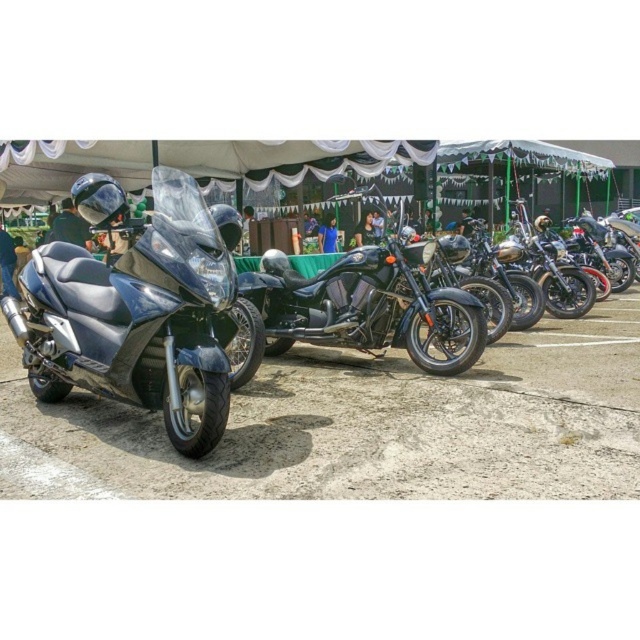
Question: Does matte black scooter at left appear on the left side of glossy black motorcycle at center?

Choices:
 (A) no
 (B) yes

Answer: (B)

Question: Does matte black scooter at left appear on the right side of shiny chrome motorcycle at center?

Choices:
 (A) yes
 (B) no

Answer: (B)

Question: Which of the following is the farthest from the observer?

Choices:
 (A) glossy black motorcycle at center
 (B) matte black scooter at left
 (C) shiny chrome motorcycle at center

Answer: (C)

Question: Estimate the real-world distances between objects in this image. Which object is farther from the shiny chrome motorcycle at center?

Choices:
 (A) glossy black motorcycle at center
 (B) matte black scooter at left

Answer: (B)

Question: Which of these objects is positioned farthest from the matte black scooter at left?

Choices:
 (A) glossy black motorcycle at center
 (B) shiny chrome motorcycle at center

Answer: (B)

Question: Is glossy black motorcycle at center to the left of shiny chrome motorcycle at center from the viewer's perspective?

Choices:
 (A) yes
 (B) no

Answer: (A)